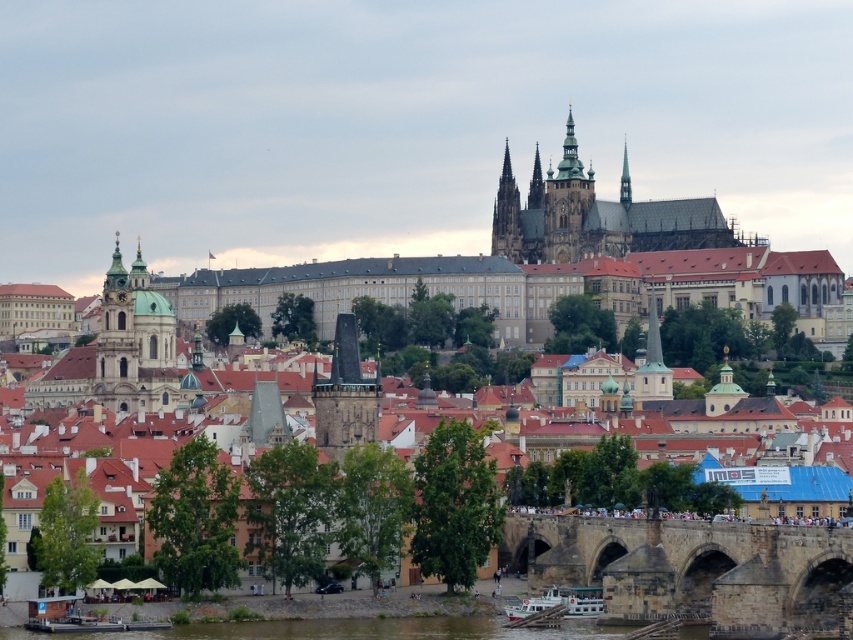
Question: Can you confirm if dark gray stone tower at center is bigger than golden spires at center?

Choices:
 (A) yes
 (B) no

Answer: (B)

Question: Does dark gray stone spire at center appear over white matte boat at lower center?

Choices:
 (A) no
 (B) yes

Answer: (B)

Question: From the image, what is the correct spatial relationship of dark gray stone tower at center in relation to dark gray stone spire at center?

Choices:
 (A) left
 (B) right

Answer: (A)

Question: Which object is positioned closest to the dark gray stone spire at center?

Choices:
 (A) brown stone castle at center
 (B) brown stone bridge at lower center
 (C) dark gray stone tower at center

Answer: (A)

Question: Which object is farther from the camera taking this photo?

Choices:
 (A) dark gray stone spire at center
 (B) golden spires at center

Answer: (A)

Question: Based on their relative distances, which object is farther from the brown stone castle at center?

Choices:
 (A) brown stone bridge at lower center
 (B) golden spires at center
 (C) white matte boat at lower center

Answer: (C)